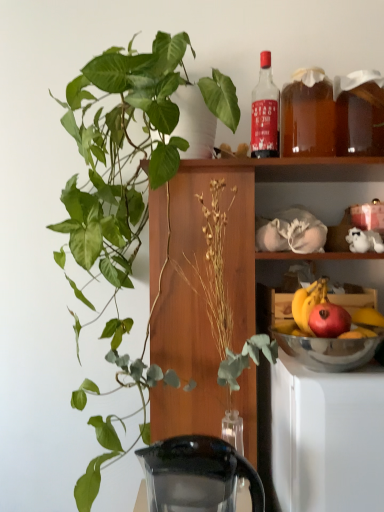
Question: From the image's perspective, is wooden cabinet at center on top of translucent amber liquid at upper right, acting as the second beverage starting from the right?

Choices:
 (A) no
 (B) yes

Answer: (A)

Question: Does wooden cabinet at center have a smaller size compared to translucent amber liquid at upper right, which is the first beverage from left to right?

Choices:
 (A) yes
 (B) no

Answer: (B)

Question: Is the depth of wooden cabinet at center less than that of translucent amber liquid at upper right, acting as the second beverage starting from the right?

Choices:
 (A) no
 (B) yes

Answer: (B)

Question: Is wooden cabinet at center positioned far away from translucent amber liquid at upper right, acting as the second beverage starting from the right?

Choices:
 (A) no
 (B) yes

Answer: (A)

Question: Are wooden cabinet at center and translucent amber liquid at upper right, which is the first beverage from left to right, making contact?

Choices:
 (A) no
 (B) yes

Answer: (A)

Question: Does wooden cabinet at center have a lesser height compared to translucent amber liquid at upper right, which is the first beverage from left to right?

Choices:
 (A) yes
 (B) no

Answer: (B)

Question: Does translucent amber liquid at shelf right, the 2th beverage positioned from the left, lie behind silver metallic bowl at lower right?

Choices:
 (A) no
 (B) yes

Answer: (B)

Question: Is translucent amber liquid at shelf right, the 2th beverage positioned from the left, in front of silver metallic bowl at lower right?

Choices:
 (A) no
 (B) yes

Answer: (A)

Question: Would you say translucent amber liquid at shelf right, the 2th beverage positioned from the left, contains silver metallic bowl at lower right?

Choices:
 (A) yes
 (B) no

Answer: (B)

Question: Can you confirm if translucent amber liquid at shelf right, which appears as the 1th beverage when viewed from the right, is taller than silver metallic bowl at lower right?

Choices:
 (A) yes
 (B) no

Answer: (A)

Question: From a real-world perspective, is translucent amber liquid at shelf right, which appears as the 1th beverage when viewed from the right, located beneath silver metallic bowl at lower right?

Choices:
 (A) no
 (B) yes

Answer: (A)

Question: Considering the relative sizes of translucent amber liquid at shelf right, which appears as the 1th beverage when viewed from the right, and silver metallic bowl at lower right in the image provided, is translucent amber liquid at shelf right, which appears as the 1th beverage when viewed from the right, bigger than silver metallic bowl at lower right?

Choices:
 (A) no
 (B) yes

Answer: (A)

Question: Is translucent amber liquid at upper right, acting as the second beverage starting from the right, at the right side of green glossy plant at upper left?

Choices:
 (A) yes
 (B) no

Answer: (A)